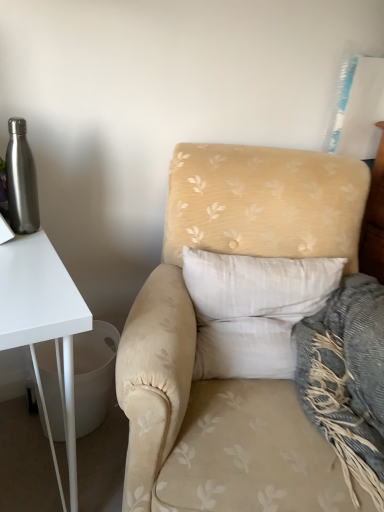
What do you see at coordinates (253, 310) in the screenshot?
I see `white soft pillow at center` at bounding box center [253, 310].

The image size is (384, 512). What do you see at coordinates (21, 180) in the screenshot?
I see `brushed metal water bottle at left` at bounding box center [21, 180].

This screenshot has height=512, width=384. Identify the location of beige floral fabric armchair at center. (196, 336).

The height and width of the screenshot is (512, 384). What do you see at coordinates (196, 336) in the screenshot?
I see `beige floral fabric armchair at center` at bounding box center [196, 336].

Where is `white soft pillow at center`? The height and width of the screenshot is (512, 384). white soft pillow at center is located at coordinates (253, 310).

Is beige floral fabric armchair at center beside brushed metal water bottle at left?

They are not placed beside each other.

From a real-world perspective, is beige floral fabric armchair at center above or below brushed metal water bottle at left?

beige floral fabric armchair at center is below brushed metal water bottle at left.

Is beige floral fabric armchair at center facing away from brushed metal water bottle at left?

No.

Considering the relative sizes of beige floral fabric armchair at center and brushed metal water bottle at left in the image provided, is beige floral fabric armchair at center wider than brushed metal water bottle at left?

Yes.

Considering the sizes of white soft pillow at center and brushed metal water bottle at left in the image, is white soft pillow at center taller or shorter than brushed metal water bottle at left?

Clearly, white soft pillow at center is taller compared to brushed metal water bottle at left.

Where is `bottle that is above the white soft pillow at center (from the image's perspective)`? bottle that is above the white soft pillow at center (from the image's perspective) is located at coordinates (21, 180).

Could you tell me if white soft pillow at center is turned towards brushed metal water bottle at left?

No, white soft pillow at center is not aimed at brushed metal water bottle at left.

From a real-world perspective, is white soft pillow at center above or below beige floral fabric armchair at center?

From a real-world perspective, white soft pillow at center is physically above beige floral fabric armchair at center.

Can you confirm if white soft pillow at center is positioned to the left of beige floral fabric armchair at center?

Yes.

Looking at this image, would you say beige floral fabric armchair at center is part of white soft pillow at center's contents?

No, white soft pillow at center does not contain beige floral fabric armchair at center.

This screenshot has width=384, height=512. Identify the location of chair that is below the white soft pillow at center (from the image's perspective). (196, 336).

Is beige floral fabric armchair at center looking in the opposite direction of white soft pillow at center?

Yes, white soft pillow at center is at the back of beige floral fabric armchair at center.

Which is in front, point (7, 162) or point (196, 347)?

The point (7, 162) is more forward.

From a real-world perspective, which is physically above, brushed metal water bottle at left or white soft pillow at center?

brushed metal water bottle at left is physically above.

Would you say brushed metal water bottle at left is to the left or to the right of beige floral fabric armchair at center in the picture?

From the image, it's evident that brushed metal water bottle at left is to the left of beige floral fabric armchair at center.

Can you confirm if brushed metal water bottle at left is thinner than beige floral fabric armchair at center?

Yes, brushed metal water bottle at left is thinner than beige floral fabric armchair at center.

Which object is more forward, brushed metal water bottle at left or beige floral fabric armchair at center?

beige floral fabric armchair at center.

From the image's perspective, between brushed metal water bottle at left and beige floral fabric armchair at center, who is located below?

beige floral fabric armchair at center, from the image's perspective.

Where is `bottle to the left of beige floral fabric armchair at center`? The width and height of the screenshot is (384, 512). bottle to the left of beige floral fabric armchair at center is located at coordinates (21, 180).

Find the location of a particular element. pillow lying on the right of brushed metal water bottle at left is located at coordinates (253, 310).

From the image, which object appears to be farther from beige floral fabric armchair at center, white soft pillow at center or brushed metal water bottle at left?

Based on the image, brushed metal water bottle at left appears to be further to beige floral fabric armchair at center.

When comparing their distances from brushed metal water bottle at left, does beige floral fabric armchair at center or white soft pillow at center seem further?

Among the two, white soft pillow at center is located further to brushed metal water bottle at left.

Considering their positions, is brushed metal water bottle at left positioned further to beige floral fabric armchair at center than white soft pillow at center?

Among the two, brushed metal water bottle at left is located further to beige floral fabric armchair at center.

From the image, which object appears to be nearer to white soft pillow at center, beige floral fabric armchair at center or brushed metal water bottle at left?

beige floral fabric armchair at center is closer to white soft pillow at center.

From the image, which object appears to be nearer to white soft pillow at center, brushed metal water bottle at left or beige floral fabric armchair at center?

beige floral fabric armchair at center is closer to white soft pillow at center.

Based on their spatial positions, is white soft pillow at center or beige floral fabric armchair at center further from brushed metal water bottle at left?

Based on the image, white soft pillow at center appears to be further to brushed metal water bottle at left.

In order to click on pillow situated between brushed metal water bottle at left and beige floral fabric armchair at center from left to right in this screenshot , I will do `click(253, 310)`.